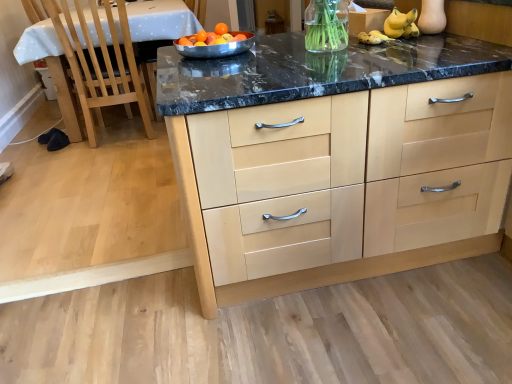
What are the coordinates of `vacant area that is in front of light wood cabinetry at center` in the screenshot? It's located at (347, 331).